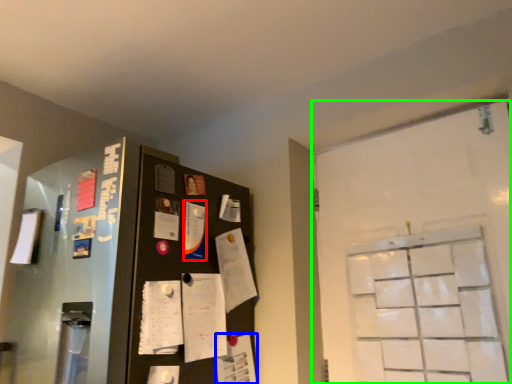
Question: Which object is positioned farthest from paper (highlighted by a red box)? Select from paper (highlighted by a blue box) and door (highlighted by a green box).

Choices:
 (A) paper
 (B) door

Answer: (B)